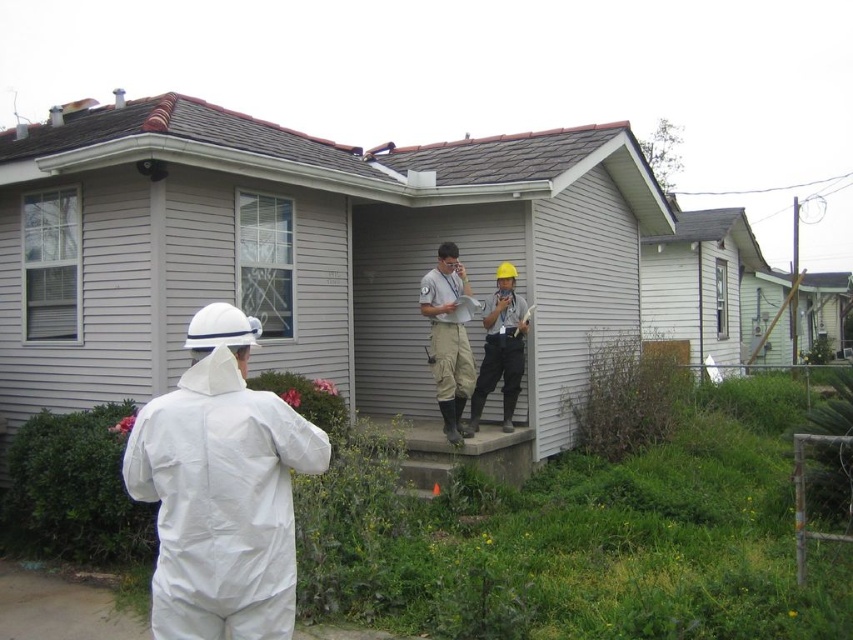
Question: Can you confirm if white matte suit at left is positioned to the left of matte gray uniform at center?

Choices:
 (A) yes
 (B) no

Answer: (A)

Question: Does white matte suit at left have a larger size compared to matte gray uniform at center?

Choices:
 (A) yes
 (B) no

Answer: (B)

Question: Considering the real-world distances, which object is closest to the matte gray uniform at center?

Choices:
 (A) hard hat at center
 (B) white matte suit at left

Answer: (A)

Question: Which of the following is the farthest from the observer?

Choices:
 (A) matte gray uniform at center
 (B) white matte suit at left
 (C) hard hat at center

Answer: (C)

Question: Is white matte suit at left bigger than hard hat at center?

Choices:
 (A) no
 (B) yes

Answer: (A)

Question: Which point is closer to the camera taking this photo?

Choices:
 (A) (459, 387)
 (B) (288, 528)

Answer: (B)